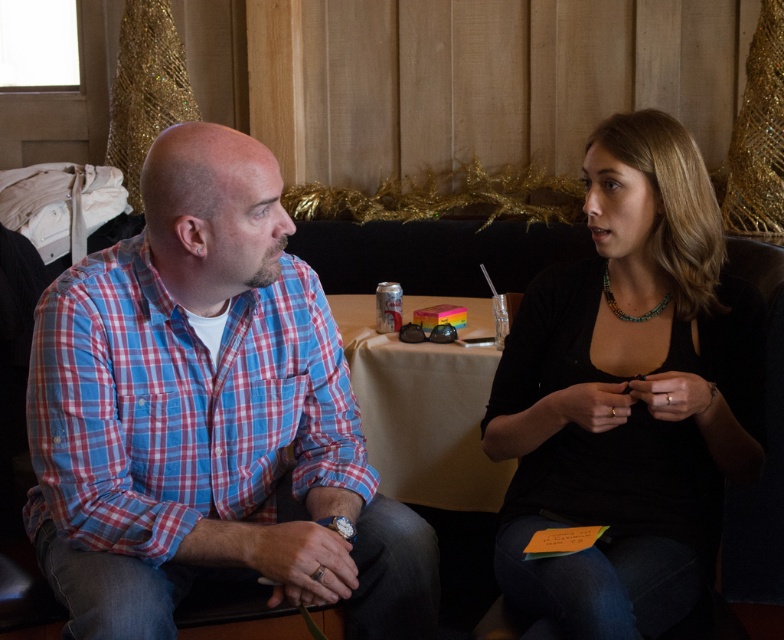
You are a fashion designer observing the two shirts in the image. The blue plaid shirt at left and the black matte shirt at center. Which shirt has a larger size?

The blue plaid shirt at left has a larger size compared to the black matte shirt at center.